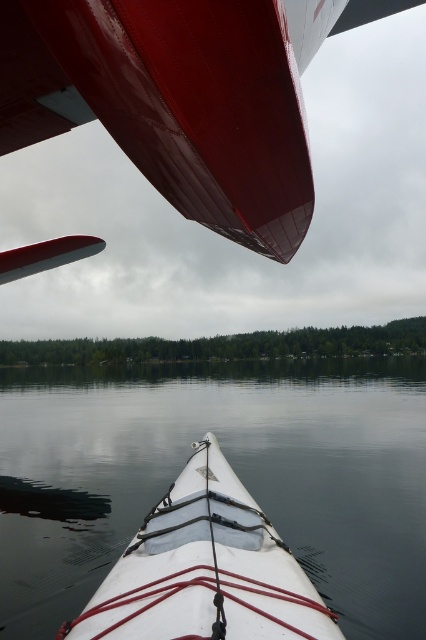
Question: Can you confirm if glossy red airplane wing at upper left is wider than white matte kayak at center?

Choices:
 (A) yes
 (B) no

Answer: (B)

Question: Is glossy red airplane wing at upper left smaller than white matte kayak at center?

Choices:
 (A) yes
 (B) no

Answer: (A)

Question: Among these points, which one is nearest to the camera?

Choices:
 (A) (261, 120)
 (B) (218, 465)

Answer: (A)

Question: Which object appears closest to the camera in this image?

Choices:
 (A) glossy red airplane wing at upper left
 (B) white matte kayak at center

Answer: (A)

Question: Which object appears farthest from the camera in this image?

Choices:
 (A) white matte kayak at center
 (B) glossy red airplane wing at upper left

Answer: (A)

Question: Can you confirm if glossy red airplane wing at upper left is wider than white matte kayak at center?

Choices:
 (A) yes
 (B) no

Answer: (B)